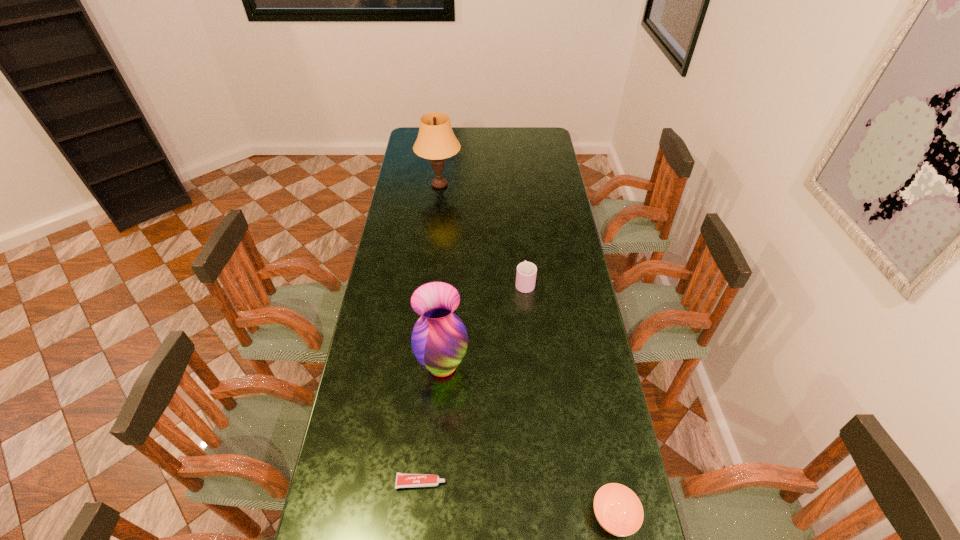
You are a GUI agent. You are given a task and a screenshot of the screen. Output one action in this format:
    pyautogui.click(x=<x>, y=<y>)
    Task: Click on the farthest object
    This screenshot has height=540, width=960.
    Given the screenshot: What is the action you would take?
    pyautogui.click(x=436, y=141)

The height and width of the screenshot is (540, 960). I want to click on the third nearest object, so click(x=439, y=340).

At what (x,y) coordinates should I click in order to perform the action: click on the fourth nearest object. Please return your answer as a coordinate pair (x, y). The width and height of the screenshot is (960, 540). Looking at the image, I should click on (526, 273).

You are a GUI agent. You are given a task and a screenshot of the screen. Output one action in this format:
    pyautogui.click(x=<x>, y=<y>)
    Task: Click on the second object from right to left
    This screenshot has height=540, width=960.
    Given the screenshot: What is the action you would take?
    pyautogui.click(x=526, y=273)

This screenshot has height=540, width=960. Find the location of `the second nearest object`. the second nearest object is located at coordinates (403, 480).

Image resolution: width=960 pixels, height=540 pixels. Find the location of `toothpaste`. toothpaste is located at coordinates (403, 480).

This screenshot has height=540, width=960. In order to click on blank space located on the back of the lampshade in this screenshot , I will do `click(444, 141)`.

The width and height of the screenshot is (960, 540). Find the location of `free space located 0.210m on the right of the vase`. free space located 0.210m on the right of the vase is located at coordinates (534, 366).

This screenshot has width=960, height=540. I want to click on vacant space located 0.280m with the handle on the side of the second farthest object, so click(519, 227).

Find the location of a particular element. This screenshot has width=960, height=540. free region located 0.130m with the handle on the side of the second farthest object is located at coordinates (521, 250).